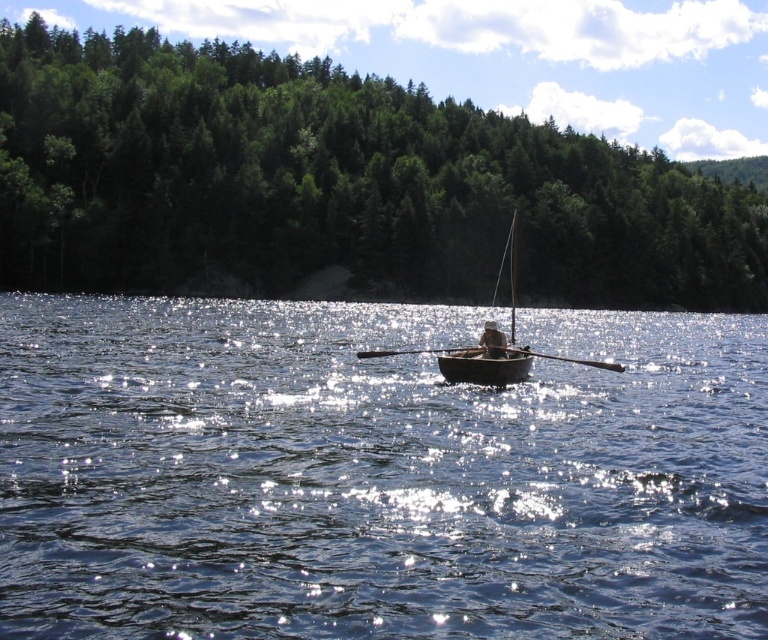
You are standing at point A, which is at coordinates point A at (511,374). You want to reach point B, which is 92.26 feet away from you. Can you estimate how far you need to walk to reach point B?

The distance between point A at (511,374) and point B is 92.26 feet, so you need to walk approximately 92.26 feet to reach point B.

You are standing on the dock and want to board the wooden canoe at center. The coordinates given are for the exact location of the canoe. If you walk straight towards the point at coordinates point (485,365), will you reach the wooden canoe at center?

Yes, because the point (485,365) corresponds to the wooden canoe at center, so walking straight towards that point will lead you directly to the wooden canoe at center.

You are standing at the point marked by the coordinates point (333,184) in the image. Looking around, you see green leafy trees at center. What is the nearest object to you?

The nearest object to you is the green leafy trees at center, as you are standing at the coordinates point (333,184) which marks their location.